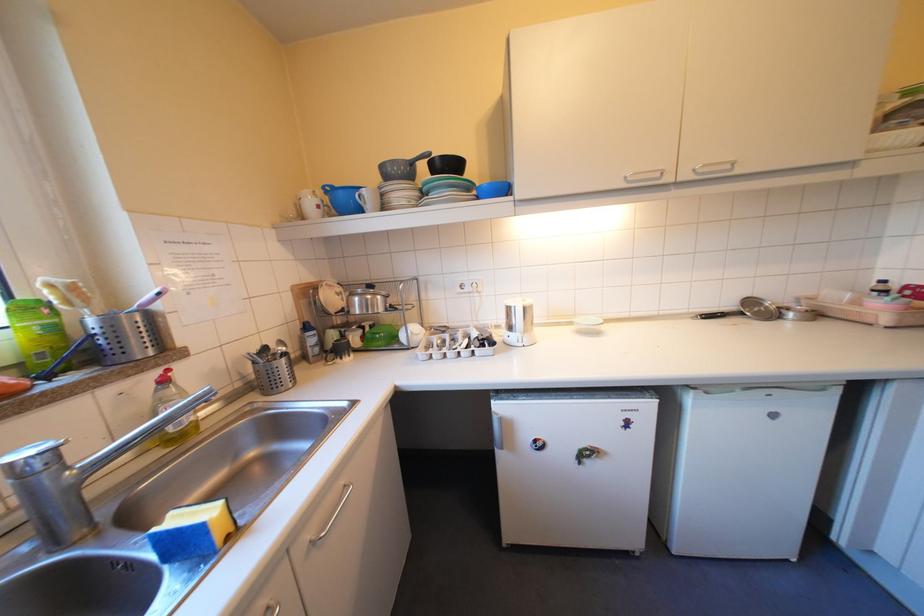
What do you see at coordinates (89, 480) in the screenshot?
I see `the faucet handle` at bounding box center [89, 480].